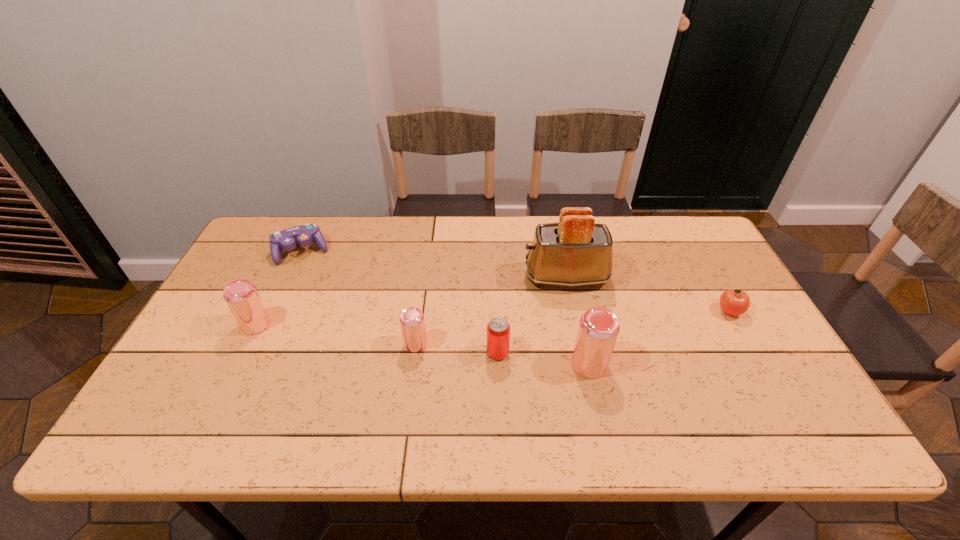
Image resolution: width=960 pixels, height=540 pixels. Find the location of `vacant spot to place a beer can on the right`. vacant spot to place a beer can on the right is located at coordinates (778, 387).